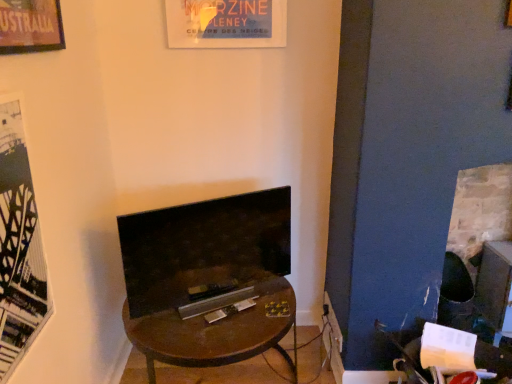
Question: Is black matte poster at left at the back of brown wooden desk at center?

Choices:
 (A) yes
 (B) no

Answer: (B)

Question: Is black matte poster at left completely or partially inside brown wooden desk at center?

Choices:
 (A) no
 (B) yes

Answer: (A)

Question: Considering the relative sizes of brown wooden desk at center and black matte poster at left in the image provided, is brown wooden desk at center bigger than black matte poster at left?

Choices:
 (A) yes
 (B) no

Answer: (A)

Question: Can you confirm if brown wooden desk at center is smaller than black matte poster at left?

Choices:
 (A) yes
 (B) no

Answer: (B)

Question: Considering the relative sizes of brown wooden desk at center and black matte poster at left in the image provided, is brown wooden desk at center shorter than black matte poster at left?

Choices:
 (A) yes
 (B) no

Answer: (A)

Question: From the image's perspective, is brick fireplace at right, positioned as the first fireplace in right-to-left order, located above or below black matte poster at left?

Choices:
 (A) below
 (B) above

Answer: (A)

Question: Considering the positions of point (470, 281) and point (6, 299), is point (470, 281) closer or farther from the camera than point (6, 299)?

Choices:
 (A) farther
 (B) closer

Answer: (A)

Question: Considering the positions of brick fireplace at right, positioned as the first fireplace in right-to-left order, and black matte poster at left in the image, is brick fireplace at right, positioned as the first fireplace in right-to-left order, wider or thinner than black matte poster at left?

Choices:
 (A) wide
 (B) thin

Answer: (A)

Question: From a real-world perspective, relative to black matte poster at left, is brick fireplace at right, positioned as the first fireplace in right-to-left order, vertically above or below?

Choices:
 (A) above
 (B) below

Answer: (B)

Question: In the image, is matte black tv at center, which is counted as the first fireplace, starting from the left, positioned in front of or behind brick fireplace at right, acting as the second fireplace starting from the left?

Choices:
 (A) front
 (B) behind

Answer: (A)

Question: From a real-world perspective, relative to brick fireplace at right, positioned as the first fireplace in right-to-left order, is matte black tv at center, which is counted as the first fireplace, starting from the left, vertically above or below?

Choices:
 (A) below
 (B) above

Answer: (B)

Question: In terms of width, does matte black tv at center, which ranks as the 2th fireplace in right-to-left order, look wider or thinner when compared to brick fireplace at right, acting as the second fireplace starting from the left?

Choices:
 (A) thin
 (B) wide

Answer: (A)

Question: Is matte black tv at center, which is counted as the first fireplace, starting from the left, bigger or smaller than brick fireplace at right, positioned as the first fireplace in right-to-left order?

Choices:
 (A) small
 (B) big

Answer: (A)

Question: From the image's perspective, is metallic silver magazine at center positioned above or below brown wooden desk at center?

Choices:
 (A) below
 (B) above

Answer: (B)

Question: Considering the positions of metallic silver magazine at center and brown wooden desk at center in the image, is metallic silver magazine at center bigger or smaller than brown wooden desk at center?

Choices:
 (A) big
 (B) small

Answer: (B)